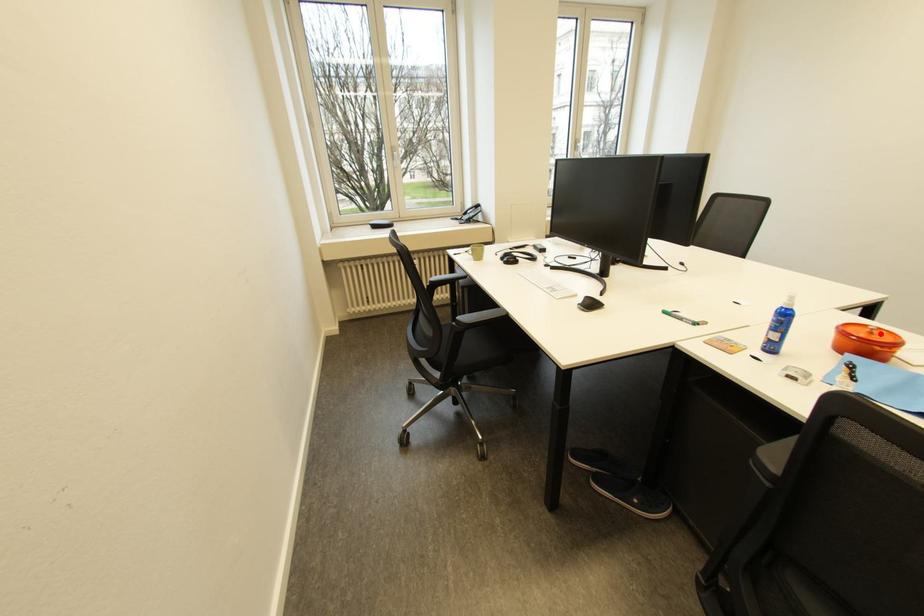
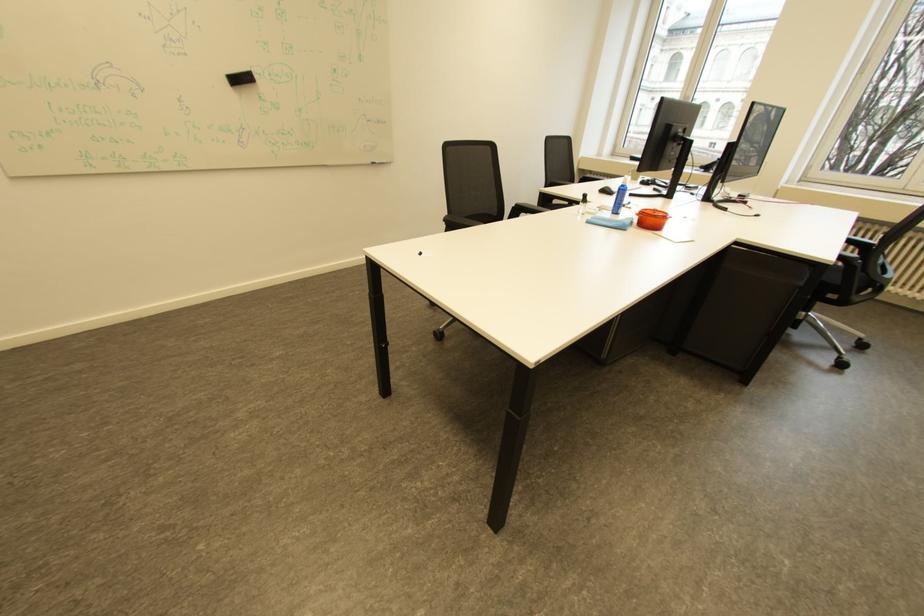
Where in the second image is the point corresponding to the highlighted location from the first image?

(664, 213)